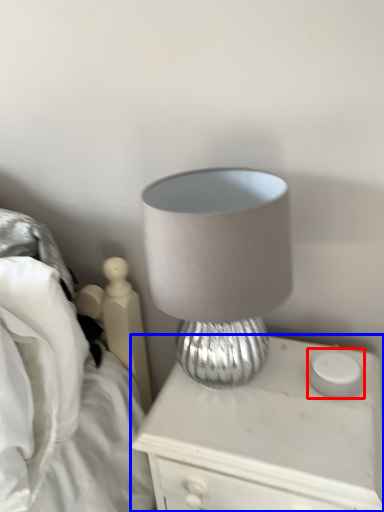
Question: Which object is closer to the camera taking this photo, candle holder (highlighted by a red box) or nightstand (highlighted by a blue box)?

Choices:
 (A) candle holder
 (B) nightstand

Answer: (B)